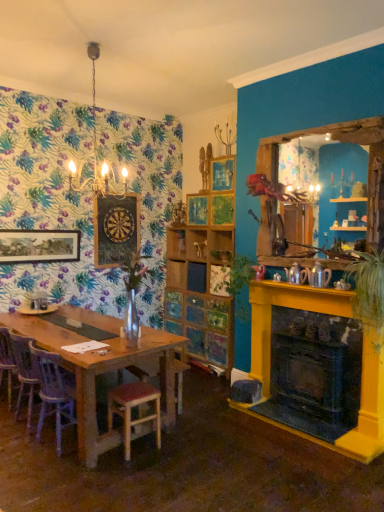
This screenshot has height=512, width=384. I want to click on free space above pine wood stool at lower left (from a real-world perspective), so click(x=132, y=390).